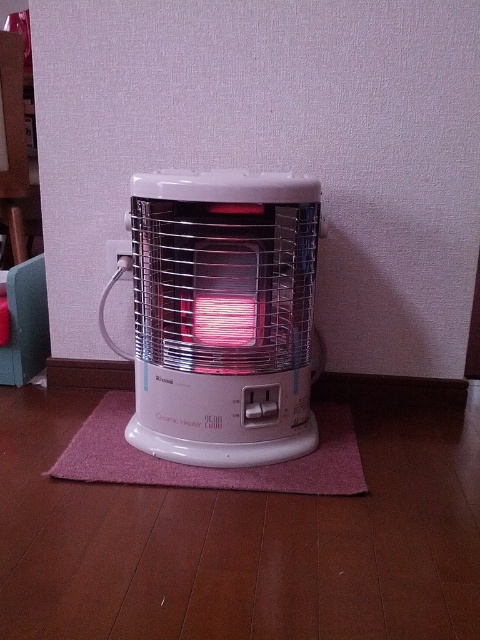
Is white glossy ceramic heater at center shorter than pink fabric mat at center?

In fact, white glossy ceramic heater at center may be taller than pink fabric mat at center.

Does white glossy ceramic heater at center have a greater height compared to pink fabric mat at center?

Correct, white glossy ceramic heater at center is much taller as pink fabric mat at center.

Who is more distant from viewer, (x=312, y=198) or (x=228, y=470)?

Point (x=228, y=470)

Where is `white glossy ceramic heater at center`? This screenshot has height=640, width=480. white glossy ceramic heater at center is located at coordinates (222, 316).